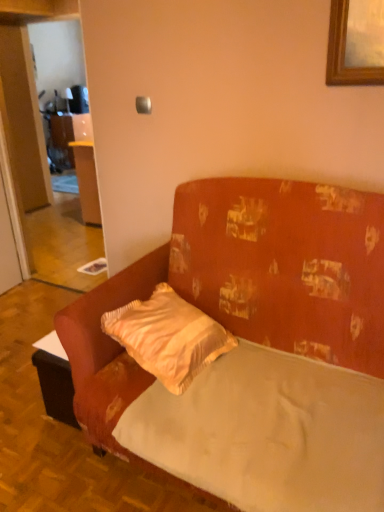
Question: Is velvet orange couch at center further to camera compared to satin yellow pillow at center?

Choices:
 (A) yes
 (B) no

Answer: (B)

Question: Considering the relative positions of velvet orange couch at center and satin yellow pillow at center in the image provided, is velvet orange couch at center to the right of satin yellow pillow at center from the viewer's perspective?

Choices:
 (A) yes
 (B) no

Answer: (A)

Question: Can you confirm if velvet orange couch at center is shorter than satin yellow pillow at center?

Choices:
 (A) no
 (B) yes

Answer: (A)

Question: Is velvet orange couch at center oriented towards satin yellow pillow at center?

Choices:
 (A) no
 (B) yes

Answer: (B)

Question: Is velvet orange couch at center surrounding satin yellow pillow at center?

Choices:
 (A) yes
 (B) no

Answer: (A)

Question: From a real-world perspective, is velvet orange couch at center physically located above or below satin yellow pillow at center?

Choices:
 (A) above
 (B) below

Answer: (A)

Question: Considering their positions, is velvet orange couch at center located in front of or behind satin yellow pillow at center?

Choices:
 (A) behind
 (B) front

Answer: (B)

Question: Considering the positions of point (307, 334) and point (206, 345), is point (307, 334) closer or farther from the camera than point (206, 345)?

Choices:
 (A) closer
 (B) farther

Answer: (B)

Question: Is velvet orange couch at center inside the boundaries of satin yellow pillow at center, or outside?

Choices:
 (A) inside
 (B) outside

Answer: (B)

Question: Is satin yellow pillow at center spatially inside smooth white mattress at center, or outside of it?

Choices:
 (A) inside
 (B) outside

Answer: (B)

Question: Would you say satin yellow pillow at center is to the left or to the right of smooth white mattress at center in the picture?

Choices:
 (A) left
 (B) right

Answer: (A)

Question: In the image, is satin yellow pillow at center positioned in front of or behind smooth white mattress at center?

Choices:
 (A) behind
 (B) front

Answer: (A)

Question: Does point (165, 345) appear closer or farther from the camera than point (235, 440)?

Choices:
 (A) farther
 (B) closer

Answer: (A)

Question: From a real-world perspective, relative to velvet orange couch at center, is satin yellow pillow at center vertically above or below?

Choices:
 (A) below
 (B) above

Answer: (A)

Question: In the image, is satin yellow pillow at center positioned in front of or behind velvet orange couch at center?

Choices:
 (A) front
 (B) behind

Answer: (B)